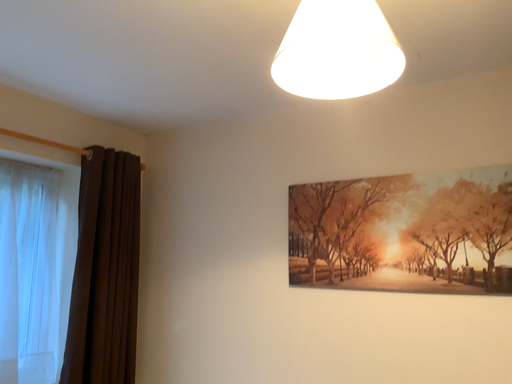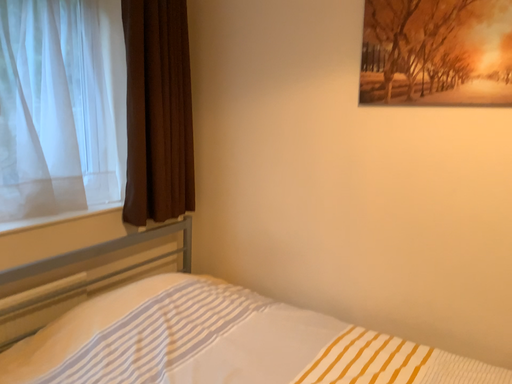
Question: How did the camera likely rotate when shooting the video?

Choices:
 (A) rotated upward
 (B) rotated downward

Answer: (B)